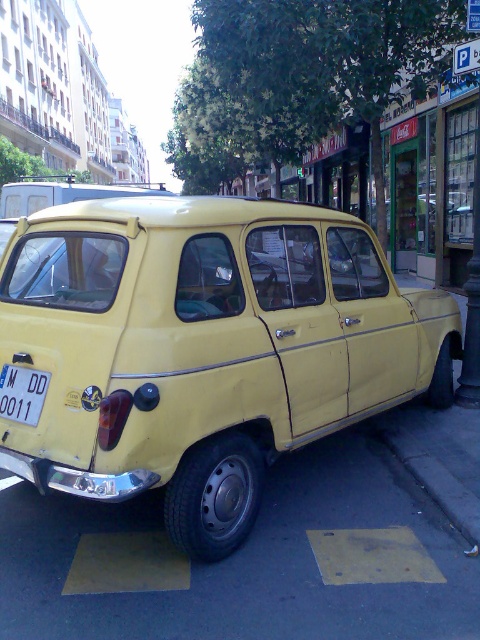
Consider the image. You are a delivery person trying to park your van, which is 2 meters wide, in a spot next to the yellow matte car at center. The parking spot has a width restriction of 1.8 meters. Can you safely park your van here if you position it next to the white plastic license plate at center?

The yellow matte car at center is wider than the white plastic license plate at center. Since the parking spot has a width restriction of 1.8 meters and your van is 2 meters wide, you cannot safely park your van here as it exceeds the allowed width.

Looking at this image, you are standing in front of the vintage yellow car parked on the street. You notice two points marked on the car. One is at coordinate point (x=356, y=314) and the other is at point (x=44, y=380). Which point is closer to you?

Point (x=356, y=314) is further to the viewer than point (x=44, y=380), so the point closer to you is point (x=44, y=380).

You are a pedestrian standing on the sidewalk. You see the yellow matte car at center and the white plastic license plate at center. Which object is closer to you?

The yellow matte car at center is closer to you than the white plastic license plate at center.